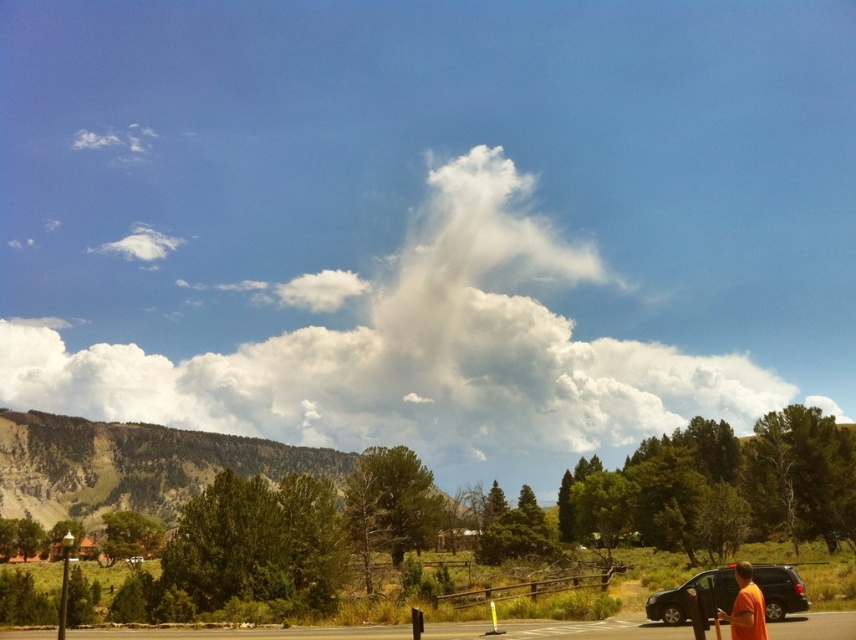
Question: Where is matte black suv at lower right located in relation to orange t-shirt at lower right in the image?

Choices:
 (A) below
 (B) above

Answer: (A)

Question: Which of the following is the farthest from the observer?

Choices:
 (A) (730, 618)
 (B) (159, 387)
 (C) (758, 579)

Answer: (B)

Question: Which point is closer to the camera?

Choices:
 (A) (241, 348)
 (B) (749, 572)
 (C) (726, 600)

Answer: (B)

Question: Does white fluffy cloud at upper center come behind orange t-shirt at lower right?

Choices:
 (A) yes
 (B) no

Answer: (A)

Question: Which point is closer to the camera?

Choices:
 (A) (681, 604)
 (B) (742, 604)
 (C) (401, 333)

Answer: (B)

Question: Can you confirm if matte black suv at lower right is positioned above orange t-shirt at lower right?

Choices:
 (A) yes
 (B) no

Answer: (B)